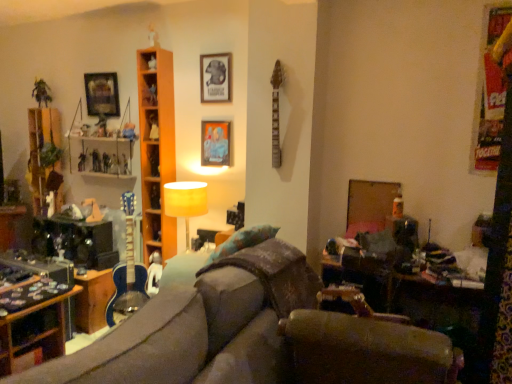
This screenshot has width=512, height=384. Describe the element at coordinates (185, 202) in the screenshot. I see `yellow fabric lampshade at center` at that location.

This screenshot has width=512, height=384. Identify the location of textured fabric pillow at center. (242, 241).

The image size is (512, 384). Describe the element at coordinates (215, 78) in the screenshot. I see `matte black picture frame at upper center, which appears as the 1th picture frame when viewed from the right` at that location.

Where is `velvet brown couch at center`? The height and width of the screenshot is (384, 512). velvet brown couch at center is located at coordinates (253, 334).

Looking at this image, is metallic figure at left, positioned as the fifth toy in right-to-left order, at the back of velvet brown couch at center?

No, velvet brown couch at center is not facing away from metallic figure at left, positioned as the fifth toy in right-to-left order.

Which of these two, velvet brown couch at center or metallic figure at left, which is the first toy from left to right, stands shorter?

metallic figure at left, which is the first toy from left to right, is shorter.

Considering the sizes of objects velvet brown couch at center and metallic figure at left, positioned as the fifth toy in right-to-left order, in the image provided, who is wider, velvet brown couch at center or metallic figure at left, positioned as the fifth toy in right-to-left order,?

With larger width is velvet brown couch at center.

Can you confirm if velvet brown couch at center is bigger than textured fabric pillow at center?

Yes.

Can you confirm if velvet brown couch at center is shorter than textured fabric pillow at center?

No.

Can you confirm if velvet brown couch at center is thinner than textured fabric pillow at center?

No.

Is shiny plastic action figure at left, which ranks as the 3th toy in right-to-left order, oriented away from metallic blue guitar at center-left, which is the 5th toy from left to right?

No, shiny plastic action figure at left, which ranks as the 3th toy in right-to-left order, is not facing the opposite direction of metallic blue guitar at center-left, which is the 5th toy from left to right.

Considering their positions, is shiny plastic action figure at left, which ranks as the 3th toy in right-to-left order, located in front of or behind metallic blue guitar at center-left, the first toy when ordered from right to left?

Clearly, shiny plastic action figure at left, which ranks as the 3th toy in right-to-left order, is behind metallic blue guitar at center-left, the first toy when ordered from right to left.

Is point (104, 162) behind point (124, 165)?

Yes, it is.

Consider the image. Is shiny plastic action figure at left, which ranks as the 3th toy in right-to-left order, positioned far away from metallic blue guitar at center-left, which is the 5th toy from left to right?

No, shiny plastic action figure at left, which ranks as the 3th toy in right-to-left order, is in close proximity to metallic blue guitar at center-left, which is the 5th toy from left to right.

Can you confirm if yellow fabric lampshade at center is shorter than metallic figure at left, positioned as the fifth toy in right-to-left order?

No.

From a real-world perspective, relative to metallic figure at left, which is the first toy from left to right, is yellow fabric lampshade at center vertically above or below?

yellow fabric lampshade at center is below metallic figure at left, which is the first toy from left to right.

Would you say yellow fabric lampshade at center is outside metallic figure at left, which is the first toy from left to right?

Yes, yellow fabric lampshade at center is located beyond the bounds of metallic figure at left, which is the first toy from left to right.

Is yellow fabric lampshade at center thinner than metallic figure at left, positioned as the fifth toy in right-to-left order?

No.

Locate an element on the screen. The image size is (512, 384). the 2nd toy behind the velvet brown couch at center is located at coordinates (114, 165).

Could you measure the distance between metallic silver toy at center, positioned as the second toy in right-to-left order, and velvet brown couch at center?

The distance of metallic silver toy at center, positioned as the second toy in right-to-left order, from velvet brown couch at center is 2.41 meters.

Looking at this image, is metallic silver toy at center, positioned as the second toy in right-to-left order, outside of velvet brown couch at center?

Absolutely, metallic silver toy at center, positioned as the second toy in right-to-left order, is external to velvet brown couch at center.

From a real-world perspective, is metallic silver toy at center, positioned as the second toy in right-to-left order, positioned above or below velvet brown couch at center?

metallic silver toy at center, positioned as the second toy in right-to-left order, is situated higher than velvet brown couch at center in the real world.

Between textured fabric pillow at center and velvet brown couch at center, which one appears on the left side from the viewer's perspective?

Positioned to the left is velvet brown couch at center.

Which is behind, point (234, 238) or point (269, 295)?

The point (234, 238) is behind.

Would you say velvet brown couch at center is part of textured fabric pillow at center's contents?

No, velvet brown couch at center is not inside textured fabric pillow at center.

Looking at this image, considering the sizes of objects textured fabric pillow at center and velvet brown couch at center in the image provided, who is thinner, textured fabric pillow at center or velvet brown couch at center?

Thinner between the two is textured fabric pillow at center.

Image resolution: width=512 pixels, height=384 pixels. In order to click on the 2nd toy directly beneath the metallic silver figurine at upper left, positioned as the 4th toy in right-to-left order (from a real-world perspective) in this screenshot , I will do `click(126, 164)`.

Consider the image. Can you tell me how much metallic blue guitar at center-left, the first toy when ordered from right to left, and metallic silver figurine at upper left, positioned as the 4th toy in right-to-left order, differ in facing direction?

The facing directions of metallic blue guitar at center-left, the first toy when ordered from right to left, and metallic silver figurine at upper left, positioned as the 4th toy in right-to-left order, are 0.00135 degrees apart.

Considering the sizes of objects metallic blue guitar at center-left, the first toy when ordered from right to left, and metallic silver figurine at upper left, positioned as the 4th toy in right-to-left order, in the image provided, who is taller, metallic blue guitar at center-left, the first toy when ordered from right to left, or metallic silver figurine at upper left, positioned as the 4th toy in right-to-left order,?

metallic silver figurine at upper left, positioned as the 4th toy in right-to-left order.

Is metallic blue guitar at center-left, which is the 5th toy from left to right, oriented towards metallic silver figurine at upper left, positioned as the 4th toy in right-to-left order?

No.

Find the location of `studio couch below the metallic figure at left, which is the first toy from left to right (from the image's perspective)`. studio couch below the metallic figure at left, which is the first toy from left to right (from the image's perspective) is located at coordinates (253, 334).

Find the location of `studio couch lying in front of the textured fabric pillow at center`. studio couch lying in front of the textured fabric pillow at center is located at coordinates [253, 334].

In the scene shown: Based on their spatial positions, is metallic blue guitar at center-left, the first toy when ordered from right to left, or metallic silver toy at center, positioned as the second toy in right-to-left order, closer to wooden table at lower right?

The object closer to wooden table at lower right is metallic blue guitar at center-left, the first toy when ordered from right to left.

Consider the image. Considering their positions, is velvet brown couch at center positioned closer to textured fabric pillow at center than metallic silver toy at center, positioned as the second toy in right-to-left order?

velvet brown couch at center lies closer to textured fabric pillow at center than the other object.

When comparing their distances from metallic figure at left, positioned as the fifth toy in right-to-left order, does orange wood cabinet at center or wooden table at lower right seem closer?

Based on the image, orange wood cabinet at center appears to be nearer to metallic figure at left, positioned as the fifth toy in right-to-left order.

Considering their positions, is metallic silver picture frame at upper left, acting as the 1th picture frame starting from the back, positioned further to velvet brown couch at center than matte black picture frame at upper center, the 3th picture frame from the back?

Based on the image, metallic silver picture frame at upper left, acting as the 1th picture frame starting from the back, appears to be further to velvet brown couch at center.

Estimate the real-world distances between objects in this image. Which object is closer to orange wood cabinet at center, velvet brown couch at center or metallic silver figurine at upper left, positioned as the 4th toy in right-to-left order?

Among the two, metallic silver figurine at upper left, positioned as the 4th toy in right-to-left order, is located nearer to orange wood cabinet at center.

Looking at the image, which one is located closer to yellow fabric lampshade at center, metallic blue guitar at center-left, the first toy when ordered from right to left, or wooden table at lower right?

metallic blue guitar at center-left, the first toy when ordered from right to left, is closer to yellow fabric lampshade at center.

Estimate the real-world distances between objects in this image. Which object is further from shiny plastic action figure at left, which ranks as the 3th toy in right-to-left order, velvet brown couch at center or yellow fabric lampshade at center?

velvet brown couch at center.

Estimate the real-world distances between objects in this image. Which object is further from velvet brown couch at center, yellow fabric lampshade at center or matte black picture frame at upper center, which ranks as the 1th picture frame in front-to-back order?

The object further to velvet brown couch at center is matte black picture frame at upper center, which ranks as the 1th picture frame in front-to-back order.

In order to click on picture frame positioned between velvet brown couch at center and matte wooden picture frame at center, the second picture frame viewed from the right, from near to far in this screenshot , I will do `click(215, 78)`.

Identify the location of picture frame between metallic silver figurine at upper left, the second toy viewed from the left, and matte wooden picture frame at center, which is the second picture frame in left-to-right order, in the horizontal direction. (102, 94).

You are a GUI agent. You are given a task and a screenshot of the screen. Output one action in this format:
    pyautogui.click(x=<x>, y=<y>)
    Task: Click on the toy positioned between orange wood cabinet at center and metallic silver toy at center, which ranks as the 4th toy in left-to-right order, from near to far
    The width and height of the screenshot is (512, 384).
    Given the screenshot: What is the action you would take?
    pyautogui.click(x=126, y=164)

At what (x,y) coordinates should I click in order to perform the action: click on cabinetry between metallic silver picture frame at upper left, positioned as the 1th picture frame in left-to-right order, and yellow fabric lampshade at center vertically. Please return your answer as a coordinate pair (x, y). Looking at the image, I should click on (156, 148).